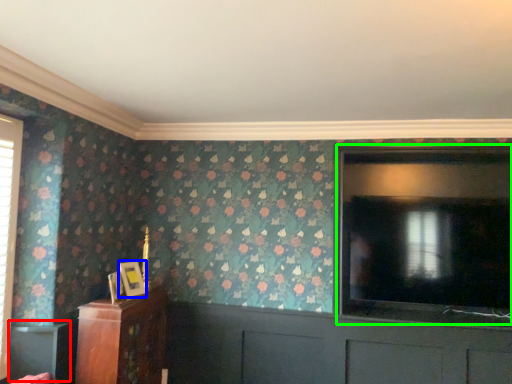
Question: Which is farther away from table (highlighted by a red box)? picture frame (highlighted by a blue box) or screen door (highlighted by a green box)?

Choices:
 (A) picture frame
 (B) screen door

Answer: (B)